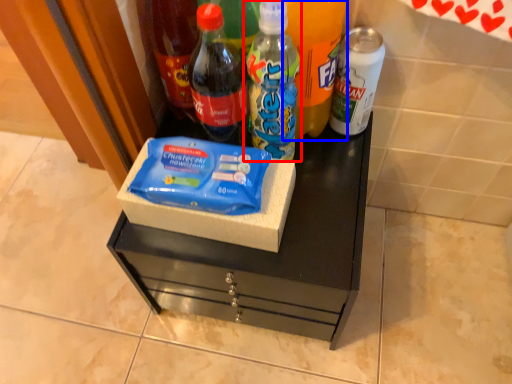
Question: Among these objects, which one is farthest to the camera, bottle (highlighted by a red box) or bottle (highlighted by a blue box)?

Choices:
 (A) bottle
 (B) bottle

Answer: (A)